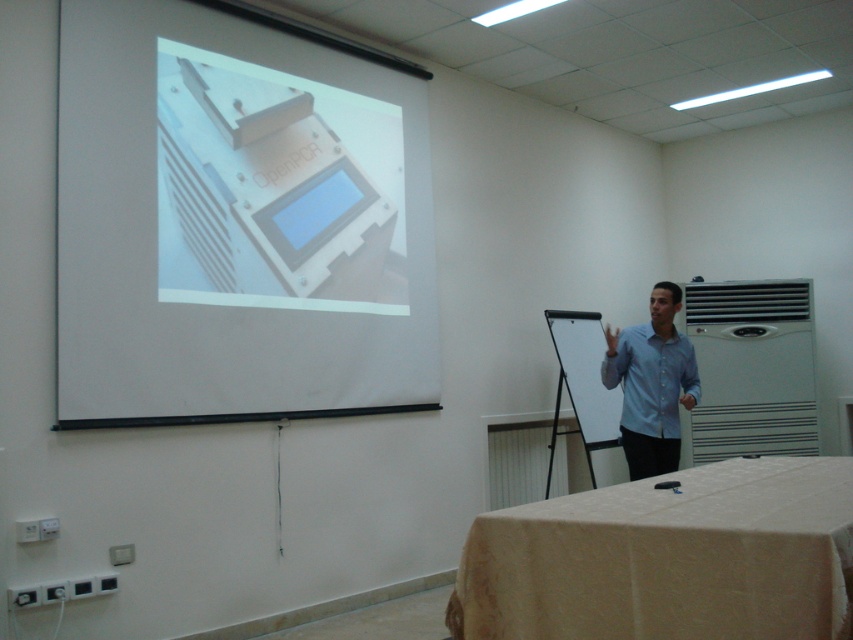
You are sitting in the conference room and want to focus on the presentation. Which point, point (419, 289) or point (614, 369), is closer to your eyes?

Point (419, 289) is further to the camera than point (614, 369), so the closer point to your eyes would be point (614, 369).

You are setting up a presentation and need to know which screen is better for showing detailed text. The white matte projector screen at upper left and the blue plastic screen at upper center are available. Which screen would you choose and why?

The white matte projector screen at upper left is much taller than the blue plastic screen at upper center, so it would provide more vertical space for displaying detailed text, making it easier to read.

You are organizing a presentation and need to place a laptop on the beige fabric table at lower right. The laptop has a width of 35 cm. Can the light blue shirt at center be placed on the same table without overlapping the laptop?

The beige fabric table at lower right is wider than the light blue shirt at center. Since the table is wider than the shirt, there should be enough space to place both the laptop and the light blue shirt at center on the table without overlapping.